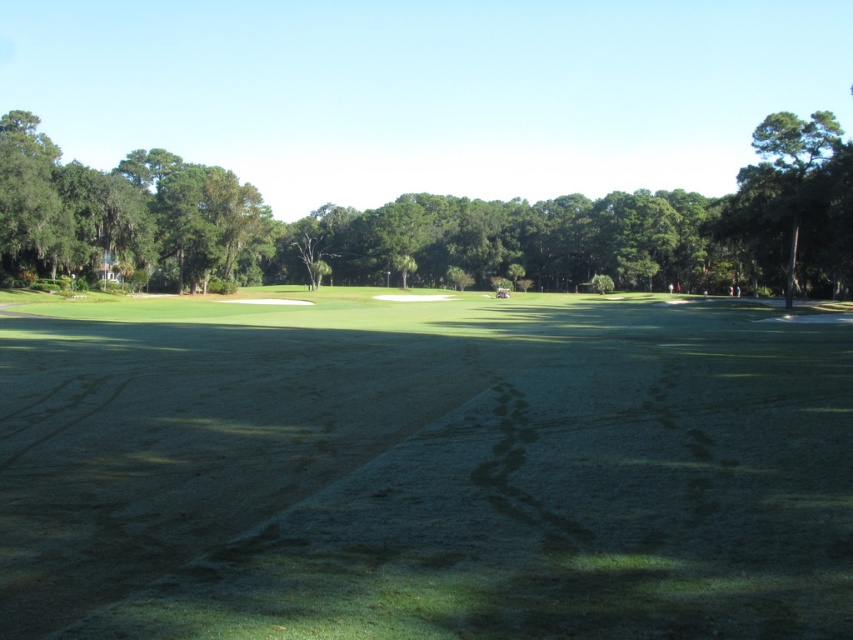
Question: Which object appears farthest from the camera in this image?

Choices:
 (A) green leafy tree at upper right
 (B) green grass at center

Answer: (A)

Question: Does green leafy tree at center have a greater width compared to green leafy tree at upper right?

Choices:
 (A) yes
 (B) no

Answer: (A)

Question: Where is green leafy tree at center located in relation to green leafy tree at upper right in the image?

Choices:
 (A) right
 (B) left

Answer: (B)

Question: Does green grass at center have a larger size compared to green leafy tree at center?

Choices:
 (A) no
 (B) yes

Answer: (A)

Question: Which point is closer to the camera?

Choices:
 (A) (828, 148)
 (B) (126, 237)
 (C) (184, 620)

Answer: (C)

Question: Which point is farther to the camera?

Choices:
 (A) green grass at center
 (B) green leafy tree at upper right

Answer: (B)